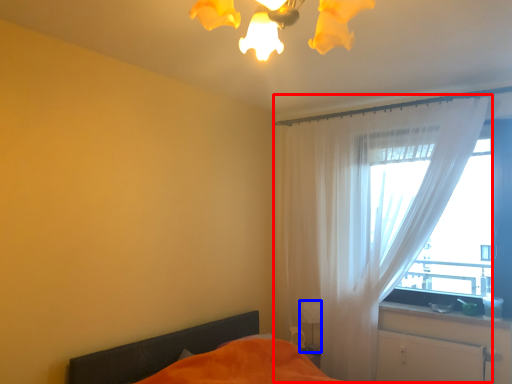
Question: Which object is closer to the camera taking this photo, curtain (highlighted by a red box) or table lamp (highlighted by a blue box)?

Choices:
 (A) curtain
 (B) table lamp

Answer: (A)